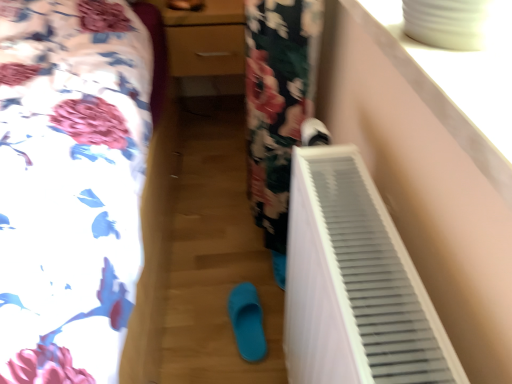
Measure the distance between point (194, 56) and camera.

Point (194, 56) is 5.88 feet away from camera.

This screenshot has height=384, width=512. In order to click on blue rubber slipper at center, which appears as the second footwear when viewed from the right in this screenshot , I will do `click(247, 321)`.

You are a GUI agent. You are given a task and a screenshot of the screen. Output one action in this format:
    pyautogui.click(x=<x>, y=<y>)
    Task: Click on the white matte shoe at upper right, marked as the 2th footwear in a bottom-to-top arrangement
    The height and width of the screenshot is (384, 512).
    Given the screenshot: What is the action you would take?
    pyautogui.click(x=314, y=133)

Between point (0, 308) and point (320, 180), which one is positioned in front?

The point (0, 308) is more forward.

Is white plastic radiator at lower right wider than white plastic radiator at right?

Indeed, white plastic radiator at lower right has a greater width compared to white plastic radiator at right.

From the picture: Considering the positions of objects white matte shoe at upper right, which is the 1th footwear in top-to-bottom order, and blue rubber slipper at center, arranged as the first footwear when viewed from the back, in the image provided, who is more to the right, white matte shoe at upper right, which is the 1th footwear in top-to-bottom order, or blue rubber slipper at center, arranged as the first footwear when viewed from the back,?

From the viewer's perspective, white matte shoe at upper right, which is the 1th footwear in top-to-bottom order, appears more on the right side.

Considering the relative sizes of white matte shoe at upper right, marked as the 2th footwear in a bottom-to-top arrangement, and blue rubber slipper at center, the second footwear viewed from the top, in the image provided, is white matte shoe at upper right, marked as the 2th footwear in a bottom-to-top arrangement, smaller than blue rubber slipper at center, the second footwear viewed from the top,?

Correct, white matte shoe at upper right, marked as the 2th footwear in a bottom-to-top arrangement, occupies less space than blue rubber slipper at center, the second footwear viewed from the top.

Is point (303, 129) positioned after point (260, 329)?

No, (303, 129) is in front of (260, 329).

Measure the distance from white matte shoe at upper right, marked as the 2th footwear in a bottom-to-top arrangement, to blue rubber slipper at center, arranged as the first footwear when viewed from the back.

Result: white matte shoe at upper right, marked as the 2th footwear in a bottom-to-top arrangement, and blue rubber slipper at center, arranged as the first footwear when viewed from the back, are 59.04 centimeters apart.

Considering the positions of point (305, 293) and point (308, 118), is point (305, 293) closer or farther from the camera than point (308, 118)?

Point (305, 293) is closer to the camera than point (308, 118).

Where is `footwear above the white plastic radiator at right (from the image's perspective)`? The height and width of the screenshot is (384, 512). footwear above the white plastic radiator at right (from the image's perspective) is located at coordinates (314, 133).

From a real-world perspective, is white plastic radiator at right beneath white matte shoe at upper right, acting as the 1th footwear starting from the front?

Yes, from a real-world perspective, white plastic radiator at right is beneath white matte shoe at upper right, acting as the 1th footwear starting from the front.

Between white plastic radiator at right and white matte shoe at upper right, the second footwear in the back-to-front sequence, which one has larger size?

white plastic radiator at right.

Considering the points (318, 135) and (383, 243), which point is behind, point (318, 135) or point (383, 243)?

Point (318, 135)

Considering the relative sizes of white matte shoe at upper right, acting as the 2th footwear starting from the left, and white plastic radiator at right in the image provided, is white matte shoe at upper right, acting as the 2th footwear starting from the left, wider than white plastic radiator at right?

In fact, white matte shoe at upper right, acting as the 2th footwear starting from the left, might be narrower than white plastic radiator at right.

From the white plastic radiator at right, count the 1st footwear to the left and point to it. Please provide its 2D coordinates.

[(314, 133)]

Based on their sizes in the image, would you say white matte shoe at upper right, acting as the 1th footwear starting from the front, is bigger or smaller than white plastic radiator at right?

white matte shoe at upper right, acting as the 1th footwear starting from the front, is smaller than white plastic radiator at right.

Is matte wood dresser at center placed right next to blue rubber slipper at center, the second footwear viewed from the top?

They are not placed beside each other.

This screenshot has height=384, width=512. In order to click on dresser that is above the blue rubber slipper at center, the second footwear viewed from the top (from the image's perspective) in this screenshot , I will do `click(206, 47)`.

From the image's perspective, who appears lower, matte wood dresser at center or blue rubber slipper at center, the second footwear viewed from the top?

blue rubber slipper at center, the second footwear viewed from the top, from the image's perspective.

Does matte wood dresser at center turn towards blue rubber slipper at center, the 2th footwear in the front-to-back sequence?

Yes.

At what (x,y) coordinates should I click in order to perform the action: click on furniture on the left of white matte shoe at upper right, acting as the 1th footwear starting from the right. Please return your answer as a coordinate pair (x, y). This screenshot has height=384, width=512. Looking at the image, I should click on (70, 185).

Which object is thinner, white plastic radiator at lower right or white matte shoe at upper right, acting as the 2th footwear starting from the left?

white matte shoe at upper right, acting as the 2th footwear starting from the left, is thinner.

Which is nearer, (121, 252) or (327, 142)?

Point (121, 252).

From a real-world perspective, relative to white matte shoe at upper right, acting as the 2th footwear starting from the left, is white plastic radiator at lower right vertically above or below?

In terms of real-world spatial position, white plastic radiator at lower right is below white matte shoe at upper right, acting as the 2th footwear starting from the left.

Can you tell me how much matte wood dresser at center and white plastic radiator at lower right differ in facing direction?

The facing directions of matte wood dresser at center and white plastic radiator at lower right are 0.127 degrees apart.

Consider the image. Is matte wood dresser at center positioned with its back to white plastic radiator at lower right?

matte wood dresser at center does not have its back to white plastic radiator at lower right.

What are the coordinates of `dresser lying on the right of white plastic radiator at lower right` in the screenshot? It's located at (206, 47).

Is matte wood dresser at center located outside white plastic radiator at lower right?

Yes, matte wood dresser at center is located beyond the bounds of white plastic radiator at lower right.

Where is `air conditioning beneath the white plastic radiator at lower right (from a real-world perspective)`? This screenshot has width=512, height=384. air conditioning beneath the white plastic radiator at lower right (from a real-world perspective) is located at coordinates (354, 284).

Locate an element on the screen. This screenshot has width=512, height=384. footwear that is above the blue rubber slipper at center, arranged as the first footwear when viewed from the back (from the image's perspective) is located at coordinates (314, 133).

From the image, which object appears to be nearer to blue rubber slipper at center, which appears as the second footwear when viewed from the right, matte wood dresser at center or white plastic radiator at lower right?

Based on the image, white plastic radiator at lower right appears to be nearer to blue rubber slipper at center, which appears as the second footwear when viewed from the right.

Looking at the image, which one is located closer to blue rubber slipper at center, which appears as the second footwear when viewed from the right, matte wood dresser at center or white plastic radiator at right?

white plastic radiator at right.

Looking at the image, which one is located closer to white plastic radiator at lower right, white plastic radiator at right or blue rubber slipper at center, which is counted as the 1th footwear, starting from the left?

Among the two, white plastic radiator at right is located nearer to white plastic radiator at lower right.

Considering their positions, is white plastic radiator at lower right positioned further to blue rubber slipper at center, which appears as the second footwear when viewed from the right, than white plastic radiator at right?

white plastic radiator at lower right is further to blue rubber slipper at center, which appears as the second footwear when viewed from the right.

When comparing their distances from white plastic radiator at lower right, does matte wood dresser at center or white matte shoe at upper right, the second footwear in the back-to-front sequence, seem closer?

white matte shoe at upper right, the second footwear in the back-to-front sequence, is positioned closer to the anchor white plastic radiator at lower right.

Based on their spatial positions, is matte wood dresser at center or blue rubber slipper at center, the 2th footwear in the front-to-back sequence, closer to white plastic radiator at lower right?

blue rubber slipper at center, the 2th footwear in the front-to-back sequence, is positioned closer to the anchor white plastic radiator at lower right.

Which object lies further to the anchor point white plastic radiator at lower right, blue rubber slipper at center, the 2th footwear in the front-to-back sequence, or white plastic radiator at right?

blue rubber slipper at center, the 2th footwear in the front-to-back sequence, lies further to white plastic radiator at lower right than the other object.

When comparing their distances from matte wood dresser at center, does blue rubber slipper at center, arranged as the first footwear when viewed from the back, or white plastic radiator at right seem further?

white plastic radiator at right lies further to matte wood dresser at center than the other object.

At what (x,y) coordinates should I click in order to perform the action: click on footwear between matte wood dresser at center and blue rubber slipper at center, which is counted as the 1th footwear, starting from the left, from top to bottom. Please return your answer as a coordinate pair (x, y). The width and height of the screenshot is (512, 384). Looking at the image, I should click on (314, 133).

Image resolution: width=512 pixels, height=384 pixels. Identify the location of footwear between white plastic radiator at lower right and blue rubber slipper at center, which is counted as the 1th footwear, starting from the left, along the z-axis. (314, 133).

Where is `air conditioning positioned between white plastic radiator at lower right and matte wood dresser at center from near to far`? This screenshot has height=384, width=512. air conditioning positioned between white plastic radiator at lower right and matte wood dresser at center from near to far is located at coordinates (354, 284).

You are a GUI agent. You are given a task and a screenshot of the screen. Output one action in this format:
    pyautogui.click(x=<x>, y=<y>)
    Task: Click on the air conditioning between white plastic radiator at lower right and blue rubber slipper at center, which is counted as the 1th footwear, starting from the left, in the front-back direction
    This screenshot has height=384, width=512.
    Given the screenshot: What is the action you would take?
    pyautogui.click(x=354, y=284)